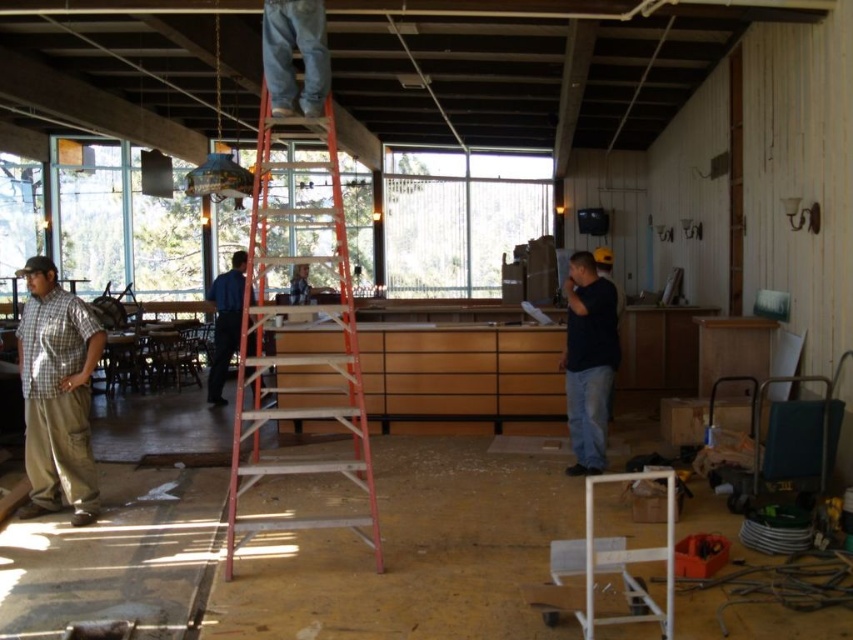
Question: Which point is farther to the camera?

Choices:
 (A) (56, 417)
 (B) (593, 346)

Answer: (B)

Question: In this image, where is orange metallic ladder at center located relative to dark blue shirt at center?

Choices:
 (A) above
 (B) below

Answer: (A)

Question: Can you confirm if dark blue shirt at center is positioned above blue shirt at center?

Choices:
 (A) yes
 (B) no

Answer: (B)

Question: Does dark blue shirt at center have a greater width compared to blue shirt at center?

Choices:
 (A) no
 (B) yes

Answer: (A)

Question: Among these points, which one is nearest to the camera?

Choices:
 (A) (222, 273)
 (B) (605, 424)
 (C) (341, 320)

Answer: (B)

Question: Estimate the real-world distances between objects in this image. Which object is closer to the checkered fabric shirt at left?

Choices:
 (A) dark blue shirt at center
 (B) orange metallic ladder at center
 (C) blue shirt at center

Answer: (B)